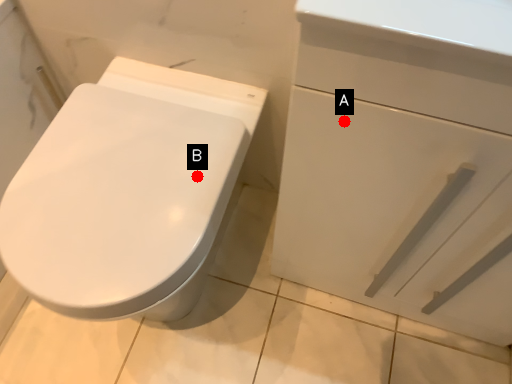
Question: Two points are circled on the image, labeled by A and B beside each circle. Which point is closer to the camera taking this photo?

Choices:
 (A) A is closer
 (B) B is closer

Answer: (A)